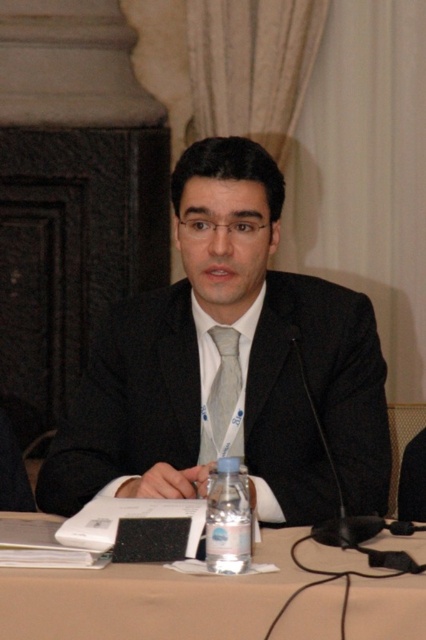
Is clear plastic bottle at center thinner than silky silver tie at center?

Indeed, clear plastic bottle at center has a lesser width compared to silky silver tie at center.

Find the location of a particular element. This screenshot has height=640, width=426. clear plastic bottle at center is located at coordinates [227, 518].

Find the location of a particular element. clear plastic bottle at center is located at coordinates (227, 518).

Is black matte suit at center shorter than clear plastic bottle at center?

No.

Can you confirm if black matte suit at center is thinner than clear plastic bottle at center?

In fact, black matte suit at center might be wider than clear plastic bottle at center.

Which is in front, point (224, 285) or point (213, 493)?

Positioned in front is point (213, 493).

The height and width of the screenshot is (640, 426). In order to click on black matte suit at center in this screenshot , I will do (x=239, y=362).

Who is higher up, black matte suit at center or silky silver tie at center?

black matte suit at center is higher up.

From the picture: Who is shorter, black matte suit at center or silky silver tie at center?

With less height is silky silver tie at center.

Where is `black matte suit at center`? This screenshot has height=640, width=426. black matte suit at center is located at coordinates [239, 362].